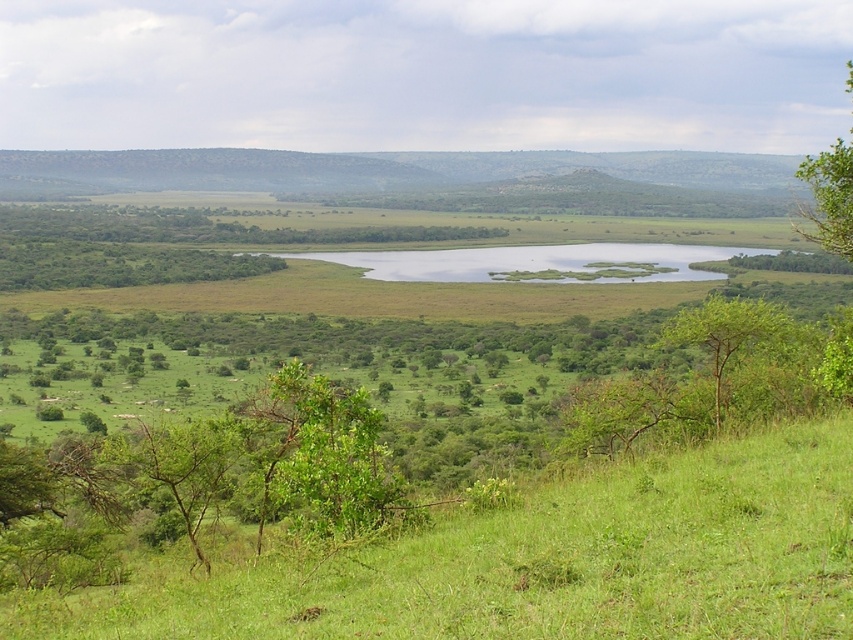
Can you confirm if green leafy tree at center is taller than green leafy tree at upper right?

No, green leafy tree at center is not taller than green leafy tree at upper right.

The image size is (853, 640). In order to click on green leafy tree at center in this screenshot , I will do `click(317, 452)`.

Is green grassy at lower center thinner than green leafy tree at lower left?

No, green grassy at lower center is not thinner than green leafy tree at lower left.

Between point (747, 550) and point (161, 438), which one is positioned behind?

Point (161, 438)

Identify the location of green grassy at lower center. (538, 561).

Looking at this image, which is more to the left, green grassy at lower center or green grassy lake at center?

green grassy at lower center is more to the left.

What do you see at coordinates (538, 561) in the screenshot? I see `green grassy at lower center` at bounding box center [538, 561].

What are the coordinates of `green grassy at lower center` in the screenshot? It's located at (538, 561).